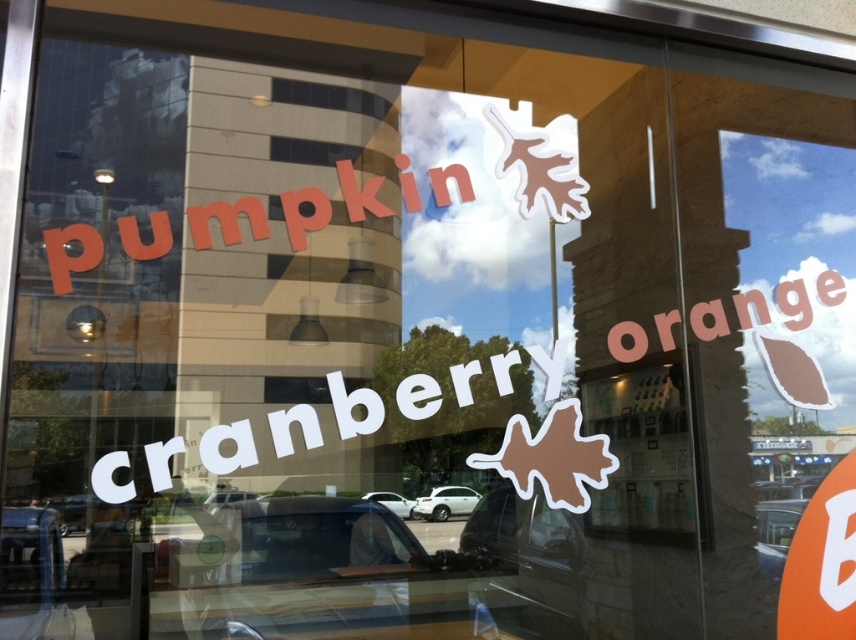
You are designing a menu for the bakery and need to know the relative sizes of the white matte cranberry at center and orange matte leaf at upper right. Which one is larger?

The white matte cranberry at center is bigger than the orange matte leaf at upper right.

You are designing a menu for the cafe and need to know the relative sizes of the pumpkin matte lettering at upper left and the orange matte leaf at upper right. Which one is larger?

The pumpkin matte lettering at upper left is bigger than the orange matte leaf at upper right.